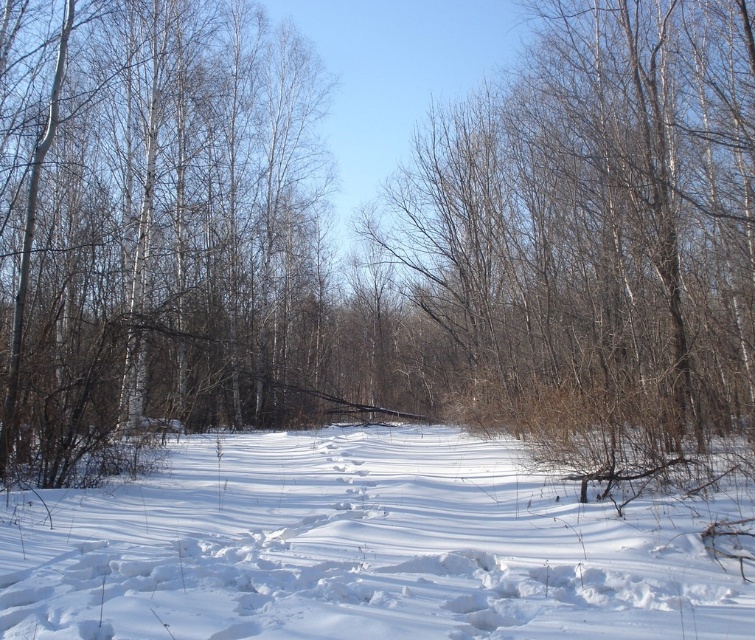
You are standing in the winter landscape and want to walk from the point closer to you to the farther point. Which path would you take between the two points, point (750, 385) and point (176, 234)?

The path from point (750, 385) to point (176, 234) would be the correct route since point (750, 385) is closer to the viewer and the other is farther away.

You are an artist planning to paint the winter landscape. You want to ensure the white bark tree at center and the white fluffy snow at center are proportionally accurate. Which object should you draw wider in your painting?

The white fluffy snow at center should be drawn wider since the white bark tree at center has a lesser width compared to it.

Based on the photo, you are an observer standing in the snowy field. You notice a white bark tree at center and white fluffy snow at center. Which object is closer to you?

The white bark tree at center is closer to you because the white fluffy snow at center is behind it.